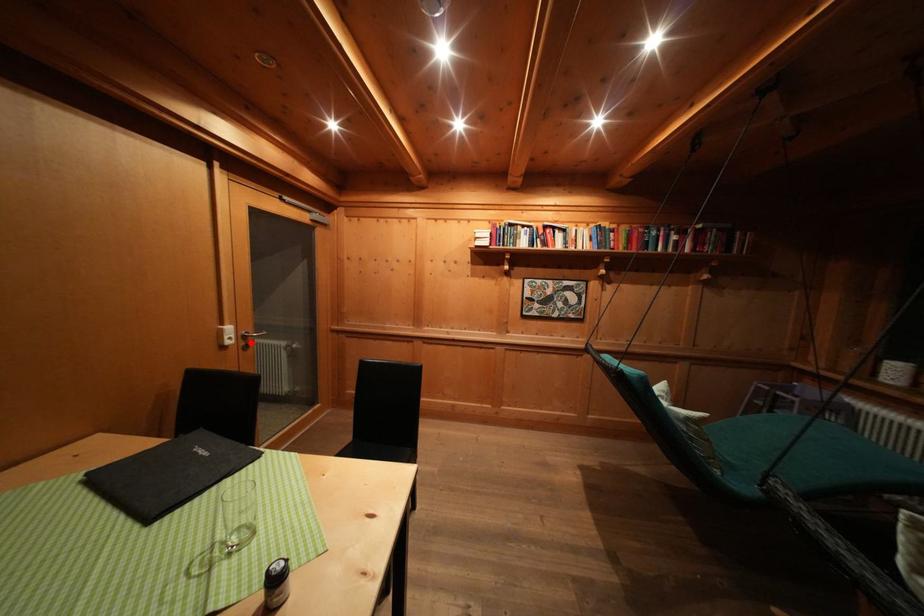
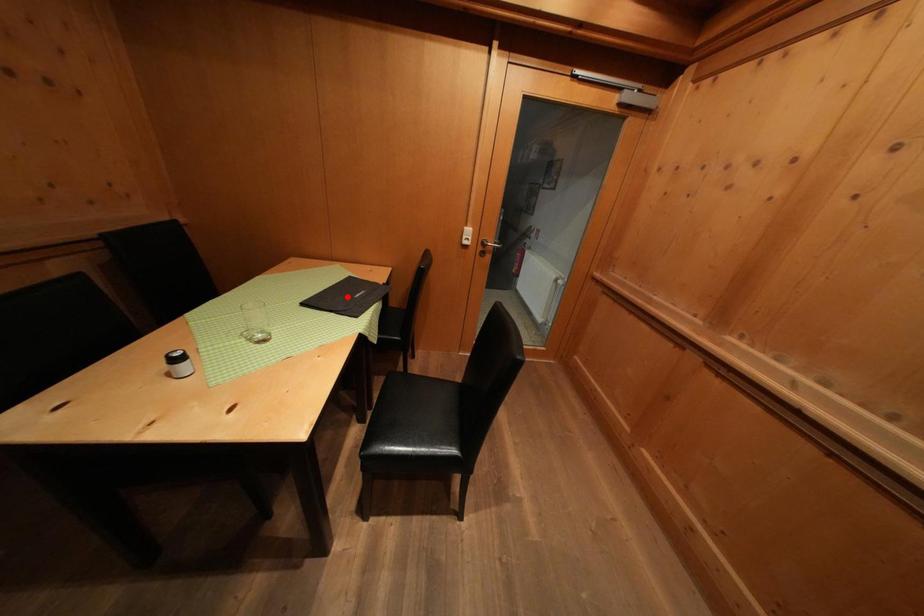
I am providing you with two images of the same scene from different viewpoints. A red point is marked on the first image and another point is marked on the second image. Do the highlighted points in image1 and image2 indicate the same real-world spot?

No